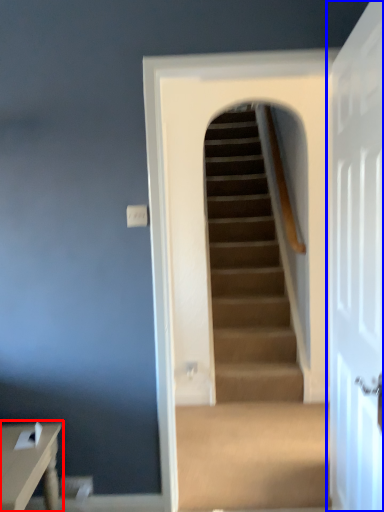
Question: Which object appears farthest to the camera in this image, table (highlighted by a red box) or door (highlighted by a blue box)?

Choices:
 (A) table
 (B) door

Answer: (A)